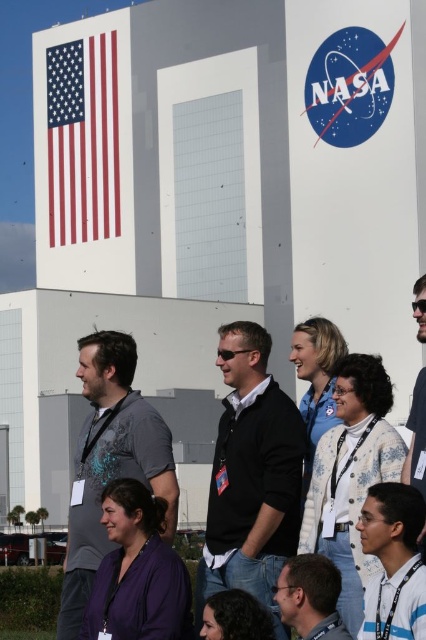
Consider the image. You are a photographer at the NASA facility and need to capture a photo of the group. You notice two people in the center wearing black matte clothing. Which one is wearing the black matte jacket at center and which is wearing the matte black shirt at center?

The black matte jacket at center is located above the matte black shirt at center, so the person wearing the black matte jacket at center is the one whose jacket is positioned higher on their body compared to the matte black shirt at center.